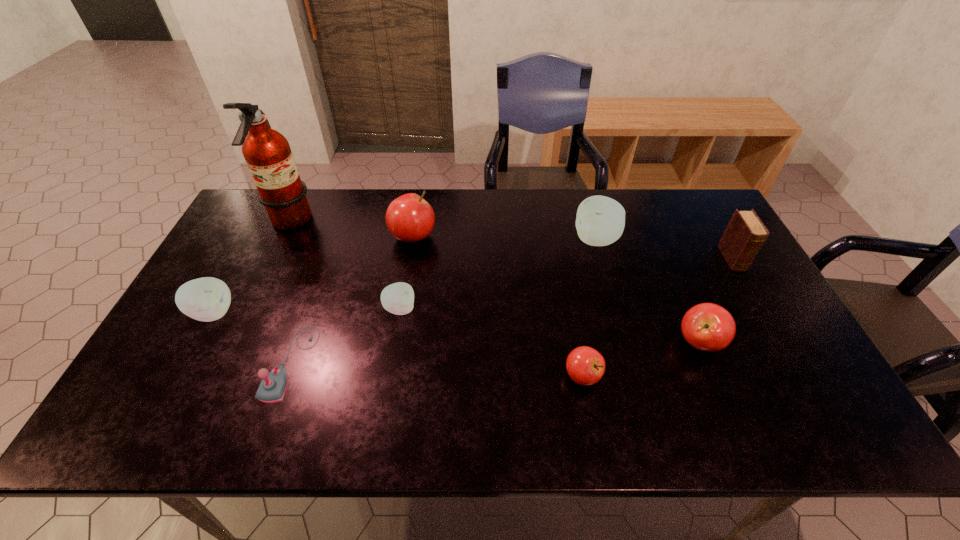
Identify the location of vacant space that's between the leftmost apple and the fire extinguisher. (252, 268).

Identify the location of free space between the biggest white apple and the leftmost white apple. (404, 276).

You are a GUI agent. You are given a task and a screenshot of the screen. Output one action in this format:
    pyautogui.click(x=<x>, y=<y>)
    Task: Click on the unoccupied area between the second biggest white apple and the brown diary
    Image resolution: width=960 pixels, height=540 pixels.
    Given the screenshot: What is the action you would take?
    pyautogui.click(x=473, y=286)

At what (x,y) coordinates should I click in order to perform the action: click on free point between the seventh object from right to left and the leftmost white apple. Please return your answer as a coordinate pair (x, y). This screenshot has width=960, height=540. Looking at the image, I should click on (252, 338).

The width and height of the screenshot is (960, 540). What are the coordinates of `free space between the smallest white apple and the rightmost red apple` in the screenshot? It's located at (550, 326).

Locate an element on the screen. This screenshot has width=960, height=540. vacant space that's between the biggest red apple and the smallest red apple is located at coordinates (497, 306).

Where is `vacant space that is in between the third object from right to left and the smallest white apple`? The image size is (960, 540). vacant space that is in between the third object from right to left and the smallest white apple is located at coordinates point(498,274).

Locate an element on the screen. The height and width of the screenshot is (540, 960). object that is the seventh closest one to the second object from right to left is located at coordinates (267, 152).

Select which object is the closest to the rightmost apple. Please provide its 2D coordinates. Your answer should be formatted as a tuple, i.e. [(x, y)], where the tuple contains the x and y coordinates of a point satisfying the conditions above.

[(585, 365)]

The image size is (960, 540). I want to click on apple that stands as the closest to the second white apple from right to left, so click(x=409, y=218).